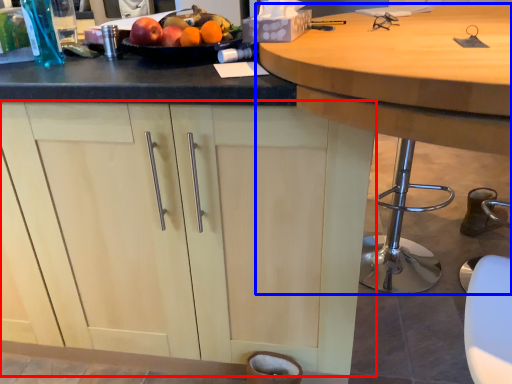
Question: Among these objects, which one is farthest to the camera, cabinetry (highlighted by a red box) or table (highlighted by a blue box)?

Choices:
 (A) cabinetry
 (B) table

Answer: (A)